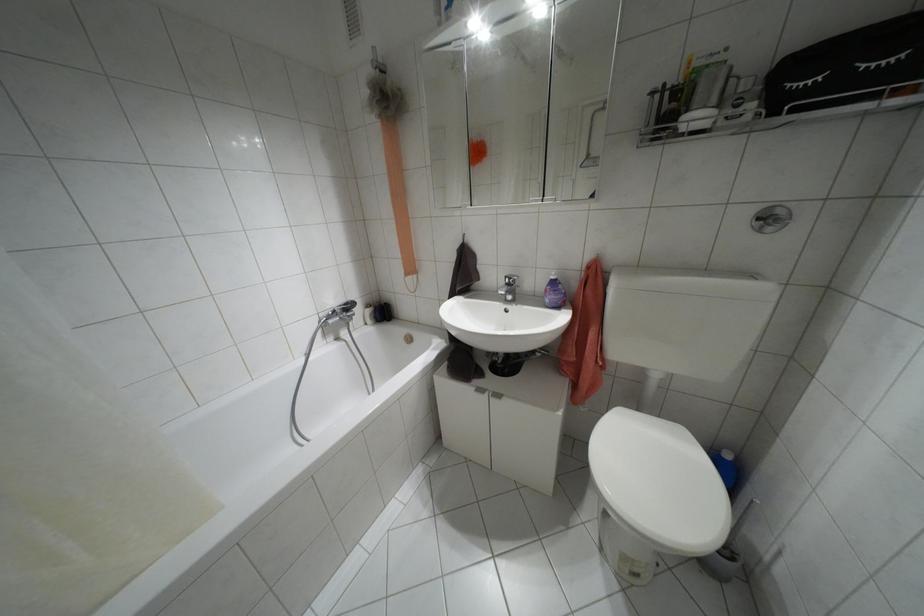
Where would you lift the bathtub faucet lever? Please return your answer as a coordinate pair (x, y).

(771, 219)